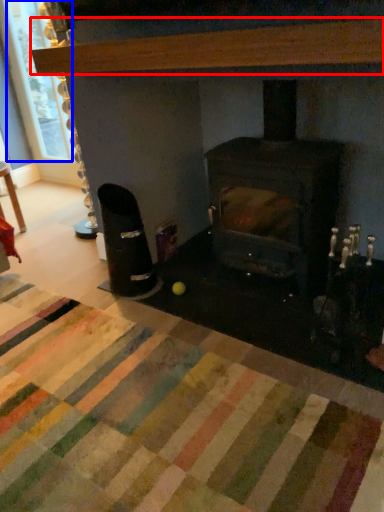
Question: Which object appears farthest to the camera in this image, hardwood (highlighted by a red box) or window screen (highlighted by a blue box)?

Choices:
 (A) hardwood
 (B) window screen

Answer: (B)